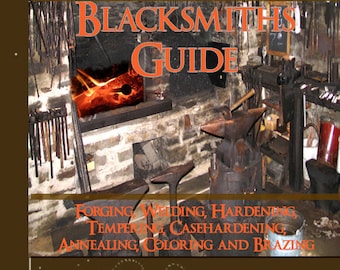
This screenshot has height=270, width=340. Identify the location of handle. (242, 99).